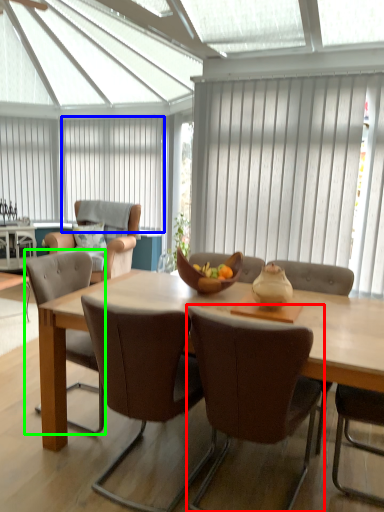
Question: Which object is positioned farthest from chair (highlighted by a red box)? Select from curtain (highlighted by a blue box) and chair (highlighted by a green box).

Choices:
 (A) curtain
 (B) chair

Answer: (A)